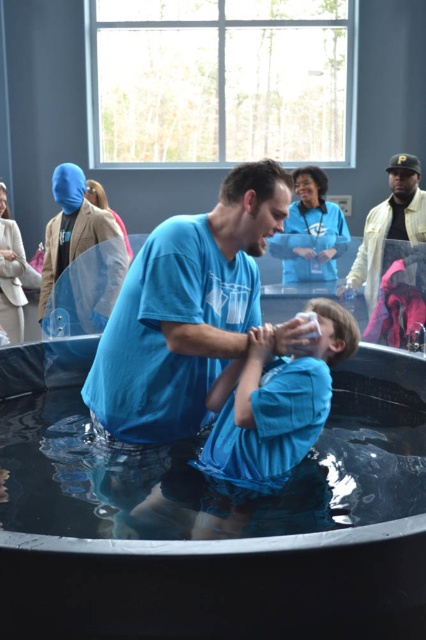
Is matte blue shirt at center shorter than yellow leather jacket at upper right?

Yes.

Does matte blue shirt at center have a greater height compared to yellow leather jacket at upper right?

No, matte blue shirt at center is not taller than yellow leather jacket at upper right.

Is point (311, 429) more distant than point (382, 266)?

No.

Identify the location of matte blue shirt at center. (265, 420).

Can you confirm if blue plastic tub at center is wider than blue cotton shirt at center?

Yes.

Who is positioned more to the left, blue plastic tub at center or blue cotton shirt at center?

blue plastic tub at center is more to the left.

Find the location of `blue plastic tub at center`. blue plastic tub at center is located at coordinates (210, 516).

Is blue cotton shirt at center to the left of blue matte mask at upper left from the viewer's perspective?

In fact, blue cotton shirt at center is to the right of blue matte mask at upper left.

What are the coordinates of `blue cotton shirt at center` in the screenshot? It's located at (186, 310).